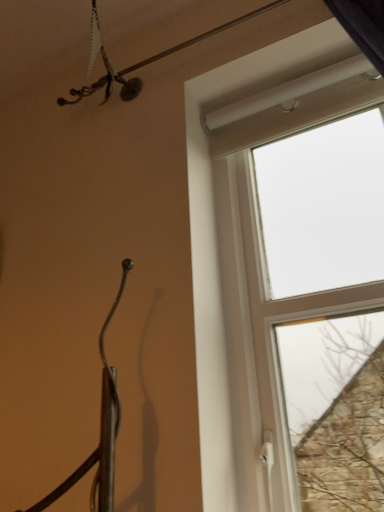
Question: Does metallic wire at upper center have a larger size compared to white plastic window at upper right?

Choices:
 (A) no
 (B) yes

Answer: (A)

Question: Is metallic wire at upper center positioned beyond the bounds of white plastic window at upper right?

Choices:
 (A) no
 (B) yes

Answer: (B)

Question: Is white plastic window at upper right inside metallic wire at upper center?

Choices:
 (A) no
 (B) yes

Answer: (A)

Question: Is metallic wire at upper center positioned far away from white plastic window at upper right?

Choices:
 (A) no
 (B) yes

Answer: (A)

Question: Considering the relative sizes of metallic wire at upper center and white plastic window at upper right in the image provided, is metallic wire at upper center thinner than white plastic window at upper right?

Choices:
 (A) no
 (B) yes

Answer: (A)

Question: Is metallic wire at upper center positioned with its back to white plastic window at upper right?

Choices:
 (A) yes
 (B) no

Answer: (B)

Question: From a real-world perspective, is white plastic window at upper right located beneath metallic wire at upper center?

Choices:
 (A) yes
 (B) no

Answer: (A)

Question: Is white plastic window at upper right shorter than metallic wire at upper center?

Choices:
 (A) no
 (B) yes

Answer: (A)

Question: Can you confirm if white plastic window at upper right is taller than metallic wire at upper center?

Choices:
 (A) yes
 (B) no

Answer: (A)

Question: Considering the relative positions of white plastic window at upper right and metallic wire at upper center in the image provided, is white plastic window at upper right to the right of metallic wire at upper center from the viewer's perspective?

Choices:
 (A) no
 (B) yes

Answer: (B)

Question: Can you confirm if white plastic window at upper right is thinner than metallic wire at upper center?

Choices:
 (A) no
 (B) yes

Answer: (B)

Question: From the image's perspective, does white plastic window at upper right appear higher than metallic wire at upper center?

Choices:
 (A) yes
 (B) no

Answer: (B)

Question: From the image's perspective, is metallic wire at upper center above or below white plastic window at upper right?

Choices:
 (A) above
 (B) below

Answer: (A)